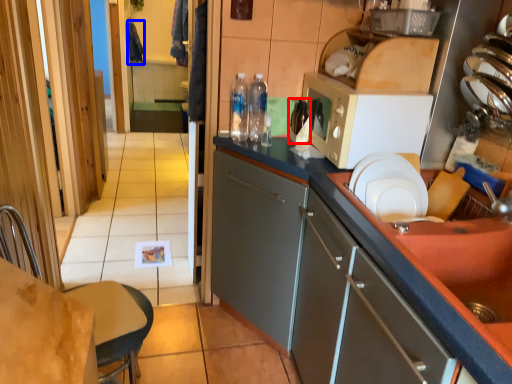
Question: Which object appears farthest to the camera in this image, bottle (highlighted by a red box) or laundry (highlighted by a blue box)?

Choices:
 (A) bottle
 (B) laundry

Answer: (B)